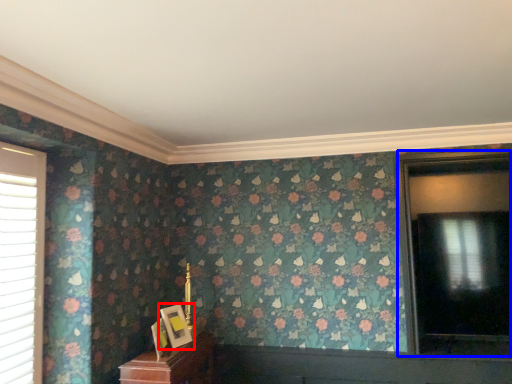
Question: Which point is further to the camera, picture frame (highlighted by a red box) or window (highlighted by a blue box)?

Choices:
 (A) picture frame
 (B) window

Answer: (B)